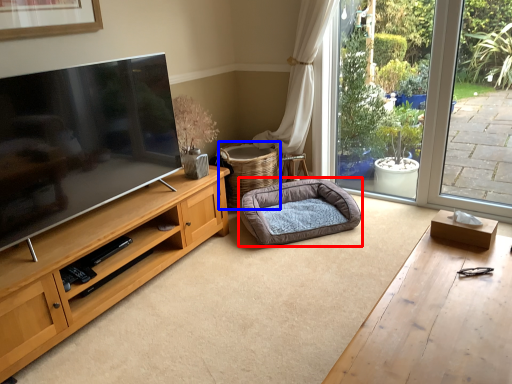
Question: Which object is further to the camera taking this photo, dog bed (highlighted by a red box) or basket (highlighted by a blue box)?

Choices:
 (A) dog bed
 (B) basket

Answer: (B)